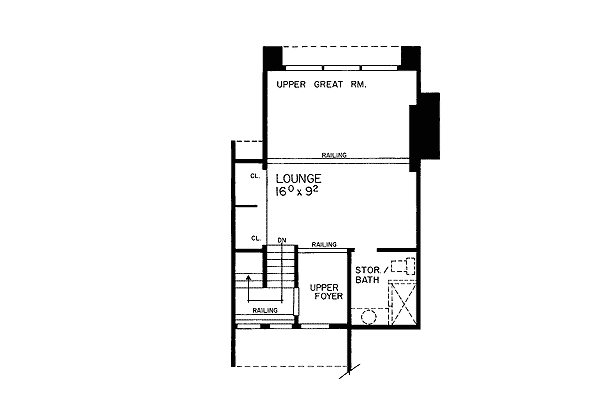
The image size is (600, 403). I want to click on lounge in black capital letters, so click(x=280, y=177), click(x=290, y=177), click(x=306, y=177), click(x=318, y=179).